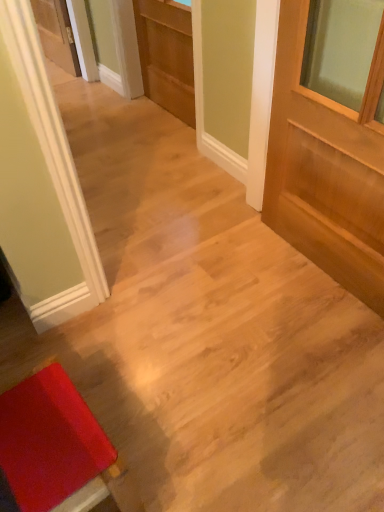
The width and height of the screenshot is (384, 512). What are the coordinates of `vacant area that is in front of light brown wood door at right, which is counted as the second door, starting from the top` in the screenshot? It's located at pos(307,348).